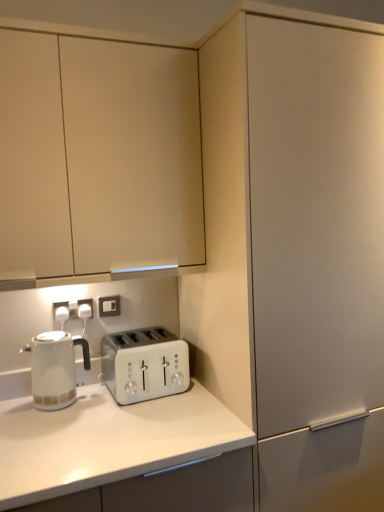
Question: Does white plastic electric outlet at upper center, the second electric outlet in the front-to-back sequence, have a greater height compared to white glossy kettle at left?

Choices:
 (A) yes
 (B) no

Answer: (B)

Question: From a real-world perspective, is white plastic electric outlet at upper center, the second electric outlet in the front-to-back sequence, located higher than white glossy kettle at left?

Choices:
 (A) no
 (B) yes

Answer: (B)

Question: Does white plastic electric outlet at upper center, marked as the 1th electric outlet in a back-to-front arrangement, appear on the right side of white glossy kettle at left?

Choices:
 (A) yes
 (B) no

Answer: (A)

Question: Considering the relative sizes of white plastic electric outlet at upper center, the 2th electric outlet viewed from the left, and white glossy kettle at left in the image provided, is white plastic electric outlet at upper center, the 2th electric outlet viewed from the left, thinner than white glossy kettle at left?

Choices:
 (A) no
 (B) yes

Answer: (B)

Question: Considering the relative sizes of white plastic electric outlet at upper center, the second electric outlet in the front-to-back sequence, and white glossy kettle at left in the image provided, is white plastic electric outlet at upper center, the second electric outlet in the front-to-back sequence, bigger than white glossy kettle at left?

Choices:
 (A) no
 (B) yes

Answer: (A)

Question: From the image's perspective, is white plastic electric outlet at upper center, the second electric outlet in the front-to-back sequence, on top of white glossy kettle at left?

Choices:
 (A) yes
 (B) no

Answer: (A)

Question: From a real-world perspective, is white plastic toaster at center over matte white cabinet at center, positioned as the 1th cabinetry in right-to-left order?

Choices:
 (A) no
 (B) yes

Answer: (A)

Question: From the image's perspective, is white plastic toaster at center under matte white cabinet at center, placed as the second cabinetry when sorted from left to right?

Choices:
 (A) no
 (B) yes

Answer: (B)

Question: Are white plastic toaster at center and matte white cabinet at center, placed as the second cabinetry when sorted from left to right, beside each other?

Choices:
 (A) no
 (B) yes

Answer: (A)

Question: Can you confirm if white plastic toaster at center is shorter than matte white cabinet at center, placed as the second cabinetry when sorted from left to right?

Choices:
 (A) yes
 (B) no

Answer: (A)

Question: Does white plastic toaster at center have a greater width compared to matte white cabinet at center, placed as the second cabinetry when sorted from left to right?

Choices:
 (A) yes
 (B) no

Answer: (B)

Question: Is white plastic toaster at center to the right of matte white cabinet at center, positioned as the 1th cabinetry in right-to-left order, from the viewer's perspective?

Choices:
 (A) no
 (B) yes

Answer: (A)

Question: Is white plastic electric outlet at lower left, acting as the 1th electric outlet starting from the front, positioned behind white plastic toaster at center?

Choices:
 (A) yes
 (B) no

Answer: (A)